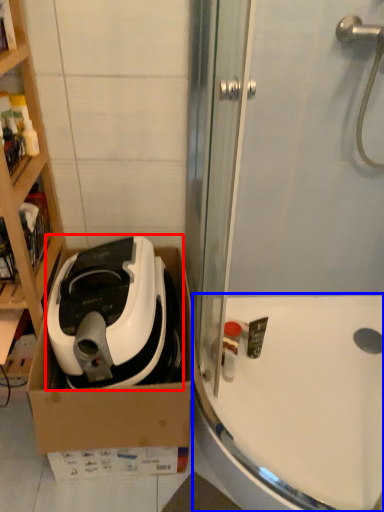
Question: Which object appears closest to the camera in this image, home appliance (highlighted by a red box) or bath (highlighted by a blue box)?

Choices:
 (A) home appliance
 (B) bath

Answer: (A)